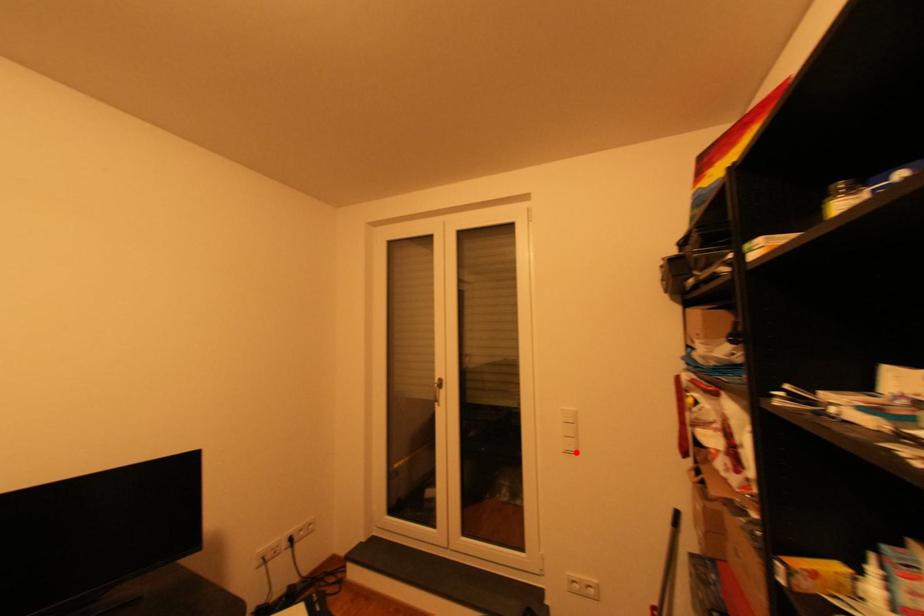
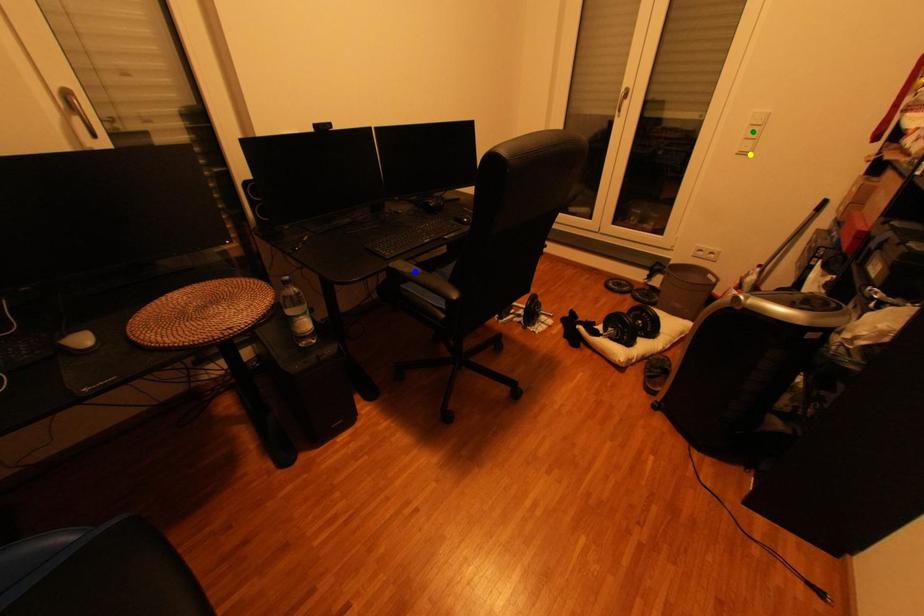
Question: I am providing you with two images of the same scene from different viewpoints. A red point is marked on the first image. You are given multiple points on the second image. Which spot in image 2 lines up with the point in image 1?

Choices:
 (A) green point
 (B) blue point
 (C) yellow point

Answer: (C)